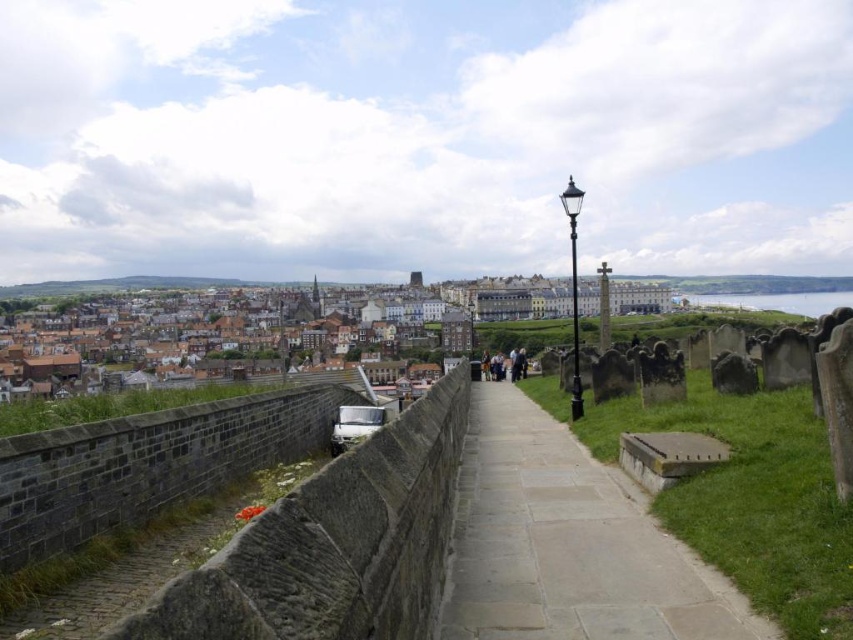
Question: Is brown brick buildings at center bigger than dark gray stone tombstones at center?

Choices:
 (A) yes
 (B) no

Answer: (A)

Question: Which point is farther to the camera?

Choices:
 (A) (177, 413)
 (B) (509, 308)
 (C) (514, 502)

Answer: (B)

Question: Which point is closer to the camera taking this photo?

Choices:
 (A) (401, 326)
 (B) (569, 531)

Answer: (B)

Question: Is gray stone path at center wider than dark gray stone tombstones at center?

Choices:
 (A) no
 (B) yes

Answer: (A)

Question: Which point is farther from the camera taking this photo?

Choices:
 (A) [149, 420]
 (B) [582, 572]
 (C) [183, 324]

Answer: (C)

Question: Is brown brick buildings at center positioned behind dark gray stone tombstones at center?

Choices:
 (A) no
 (B) yes

Answer: (B)